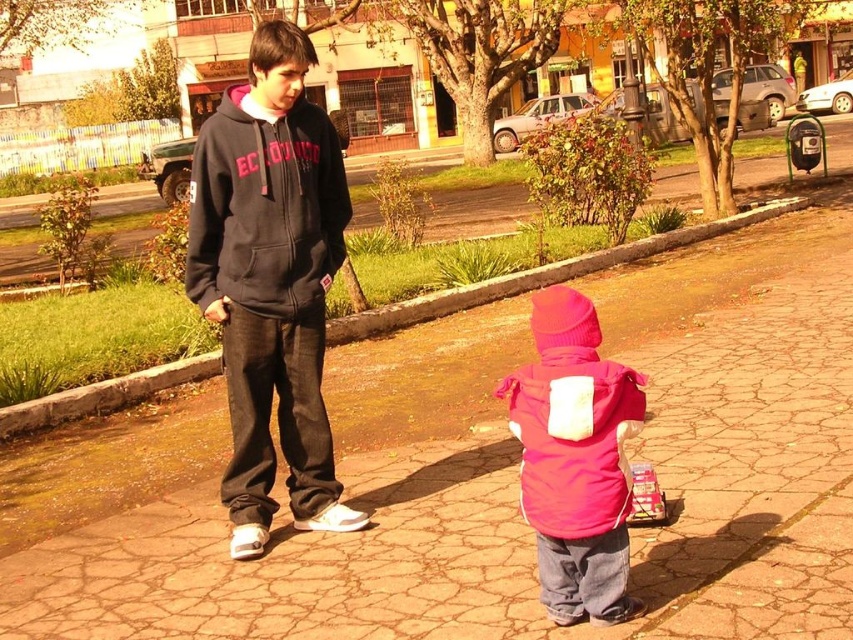
You are standing in the park and see the matte black hoodie at center. If you want to reach it without moving your feet, can you touch it?

The matte black hoodie at center is 13.98 feet away from you, so you cannot touch it without moving your feet.

You are planning to place a small bench in the outdoor scene. The bench needs to be positioned such that it does not block the path between the two children. Given the coordinates of the matte black hoodie at center, where should the bench be placed?

The bench should be placed away from the path between the two children. Since the matte black hoodie at center is located at point (x=271, y=282), the bench should be positioned outside this area to ensure the path remains clear.

You are a photographer setting up a shot of the two children in the scene. You need to ensure that both the matte black hoodie at center and the pink fleece jacket at center are clearly visible in the frame. Given their sizes, which clothing item should you focus on to ensure the entire figure is captured without cropping?

The matte black hoodie at center is bigger than the pink fleece jacket at center, so focusing on the matte black hoodie at center will ensure the entire figure is captured without cropping.